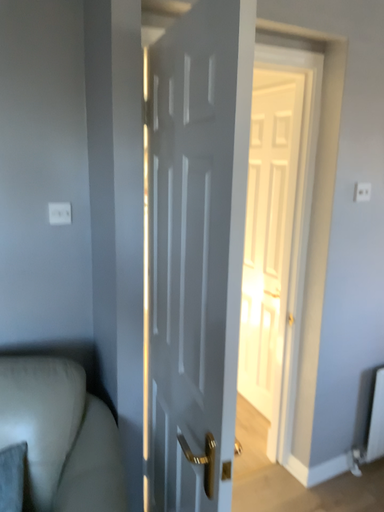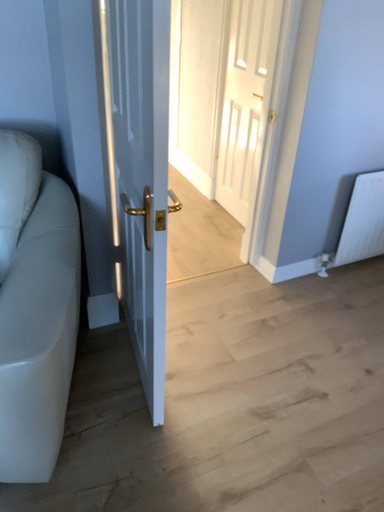
Question: Which way did the camera rotate in the video?

Choices:
 (A) rotated downward
 (B) rotated upward

Answer: (A)